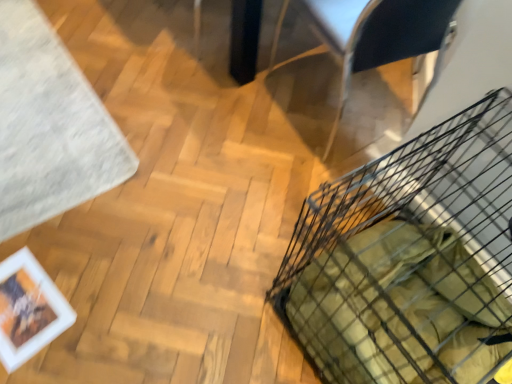
This screenshot has height=384, width=512. I want to click on vacant area that lies between white matte picture frame at lower left and white soft rug at upper left, so click(x=76, y=233).